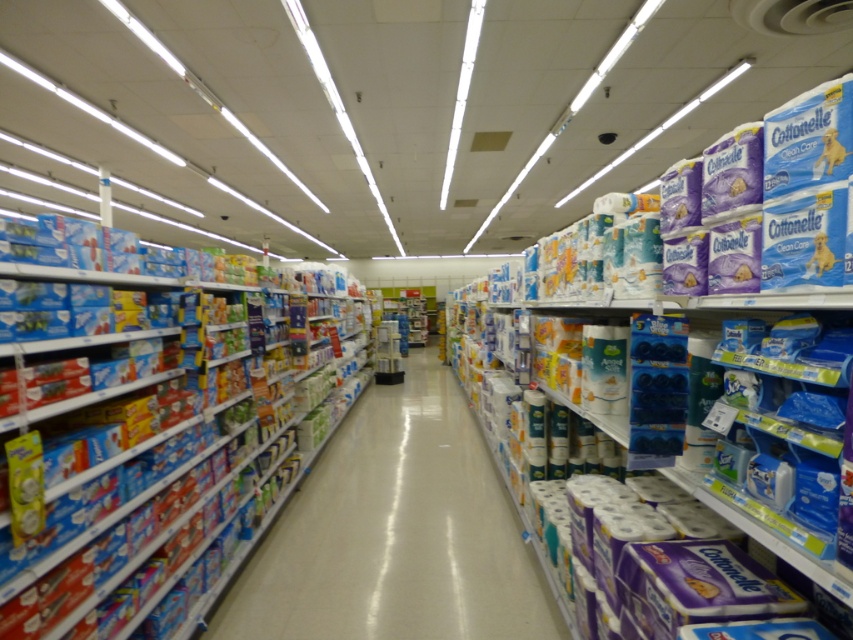
Question: Can you confirm if white paper towels at right is positioned to the right of white paper towels at center?

Choices:
 (A) no
 (B) yes

Answer: (B)

Question: Does white paper towels at right appear on the right side of white paper towels at center?

Choices:
 (A) yes
 (B) no

Answer: (A)

Question: Can you confirm if white paper towels at center is wider than blue cardboard boxes at left?

Choices:
 (A) no
 (B) yes

Answer: (B)

Question: Considering the real-world distances, which object is closest to the white paper towels at center?

Choices:
 (A) blue cardboard boxes at left
 (B) white paper towels at right

Answer: (A)

Question: Which point is closer to the camera?

Choices:
 (A) white paper towels at right
 (B) white paper towels at center

Answer: (A)

Question: Which object appears farthest from the camera in this image?

Choices:
 (A) white paper towels at right
 (B) blue cardboard boxes at left

Answer: (A)